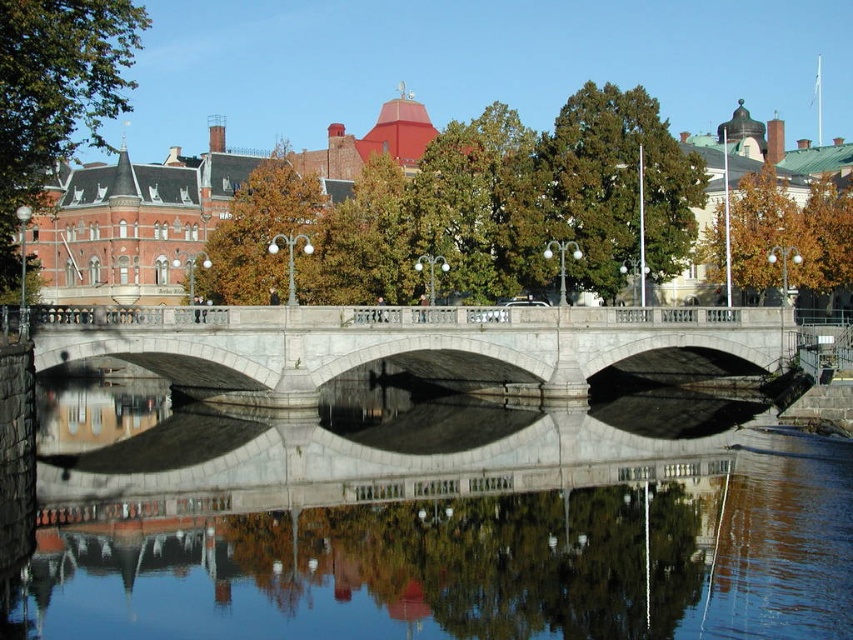
Question: Is green leafy tree at upper left in front of golden brown leaves at center?

Choices:
 (A) no
 (B) yes

Answer: (B)

Question: Does green textured tree at upper center appear on the left side of green leafy tree at upper left?

Choices:
 (A) yes
 (B) no

Answer: (B)

Question: Among these points, which one is farthest from the camera?

Choices:
 (A) (544, 202)
 (B) (286, 362)
 (C) (291, 477)

Answer: (A)

Question: Which of the following is the closest to the observer?

Choices:
 (A) 670,272
 (B) 88,134
 (C) 55,502
 (D) 730,369

Answer: (C)

Question: Among these points, which one is farthest from the camera?

Choices:
 (A) pos(564,108)
 (B) pos(280,292)

Answer: (A)

Question: Can you confirm if green textured tree at upper center is wider than golden brown leaves at center?

Choices:
 (A) no
 (B) yes

Answer: (A)